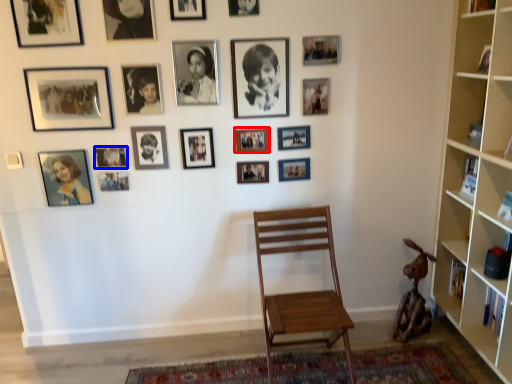
Question: Which point is further to the camera, picture frame (highlighted by a red box) or picture frame (highlighted by a blue box)?

Choices:
 (A) picture frame
 (B) picture frame

Answer: (A)